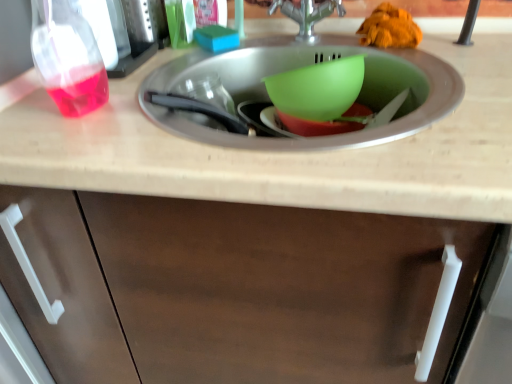
Locate an element on the screen. vacant space to the right of blue sponge at upper center, the 1th food positioned from the left is located at coordinates (286, 47).